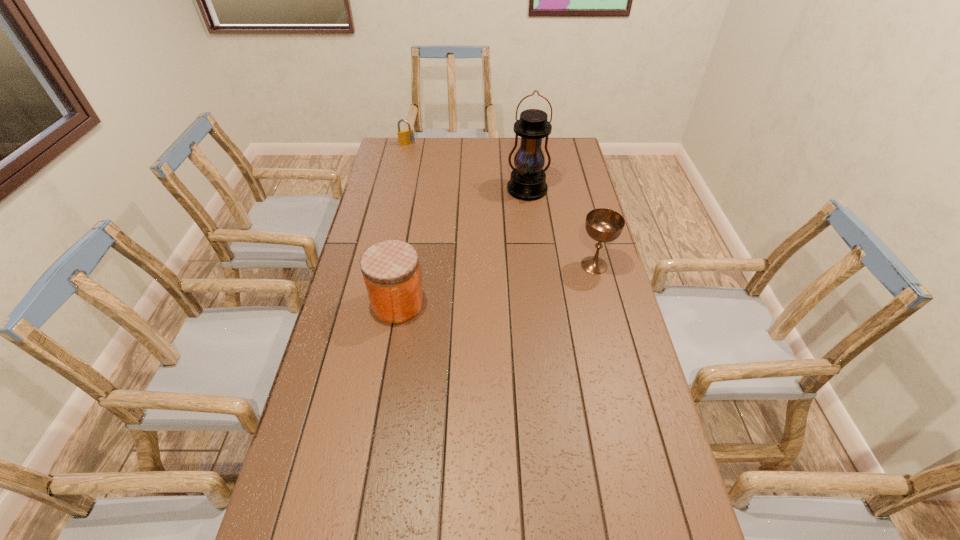
In the image, there is a desktop. At what (x,y) coordinates should I click in order to perform the action: click on vacant space at the far edge. Please return your answer as a coordinate pair (x, y). The width and height of the screenshot is (960, 540). Looking at the image, I should click on (520, 143).

In order to click on blank area at the left edge in this screenshot , I will do click(340, 381).

Locate an element on the screen. The width and height of the screenshot is (960, 540). blank space at the right edge is located at coordinates (598, 298).

Find the location of a particular element. Image resolution: width=960 pixels, height=540 pixels. free space at the near left corner of the desktop is located at coordinates (336, 515).

This screenshot has height=540, width=960. In order to click on unoccupied position between the tallest object and the jar in this screenshot , I will do `click(463, 247)`.

Find the location of a particular element. This screenshot has height=540, width=960. empty space between the second nearest object and the farthest object is located at coordinates [x=500, y=205].

Where is `free area in between the shortest object and the tallest object`? free area in between the shortest object and the tallest object is located at coordinates (467, 167).

Locate an element on the screen. free space that is in between the shortest object and the chalice is located at coordinates (500, 205).

Find the location of a particular element. free space between the farthest object and the third nearest object is located at coordinates (467, 167).

I want to click on unoccupied area between the nearest object and the third object from left to right, so click(463, 247).